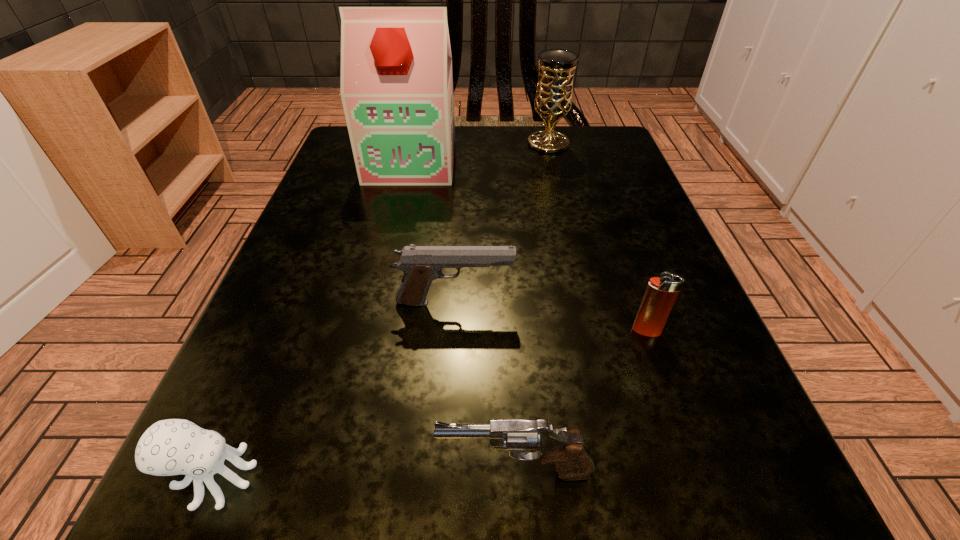
Where is `empty space that is in between the tallest object and the nearer pistol`? The height and width of the screenshot is (540, 960). empty space that is in between the tallest object and the nearer pistol is located at coordinates click(x=464, y=316).

I want to click on unoccupied area between the farther pistol and the tallest object, so click(x=433, y=232).

Identify which object is the nearest to the octopus. Please provide its 2D coordinates. Your answer should be formatted as a tuple, i.e. [(x, y)], where the tuple contains the x and y coordinates of a point satisfying the conditions above.

[(572, 460)]

Identify which object is the second nearest to the farther pistol. Please provide its 2D coordinates. Your answer should be formatted as a tuple, i.e. [(x, y)], where the tuple contains the x and y coordinates of a point satisfying the conditions above.

[(572, 460)]